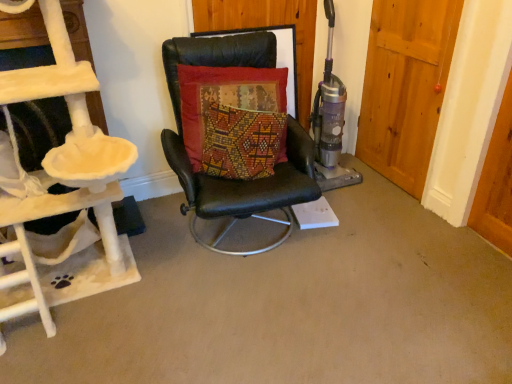
Question: Is black leather chair at center surrounded by velvet cushion at center?

Choices:
 (A) yes
 (B) no

Answer: (B)

Question: Can you confirm if velvet cushion at center is positioned to the right of black leather chair at center?

Choices:
 (A) yes
 (B) no

Answer: (B)

Question: Are velvet cushion at center and black leather chair at center beside each other?

Choices:
 (A) no
 (B) yes

Answer: (A)

Question: Is velvet cushion at center behind black leather chair at center?

Choices:
 (A) yes
 (B) no

Answer: (A)

Question: From the image's perspective, is velvet cushion at center located beneath black leather chair at center?

Choices:
 (A) yes
 (B) no

Answer: (B)

Question: Does point (247, 34) appear closer or farther from the camera than point (29, 71)?

Choices:
 (A) farther
 (B) closer

Answer: (A)

Question: Is black leather chair at center spatially inside beige plush cat tree at left, or outside of it?

Choices:
 (A) outside
 (B) inside

Answer: (A)

Question: In terms of size, does black leather chair at center appear bigger or smaller than beige plush cat tree at left?

Choices:
 (A) big
 (B) small

Answer: (B)

Question: From their relative heights in the image, would you say black leather chair at center is taller or shorter than beige plush cat tree at left?

Choices:
 (A) tall
 (B) short

Answer: (B)

Question: Considering the positions of black leather chair at center and wooden door at right in the image, is black leather chair at center bigger or smaller than wooden door at right?

Choices:
 (A) small
 (B) big

Answer: (B)

Question: Considering their positions, is black leather chair at center located in front of or behind wooden door at right?

Choices:
 (A) behind
 (B) front

Answer: (B)

Question: Is point (233, 200) closer or farther from the camera than point (376, 162)?

Choices:
 (A) farther
 (B) closer

Answer: (B)

Question: In terms of width, does black leather chair at center look wider or thinner when compared to wooden door at right?

Choices:
 (A) thin
 (B) wide

Answer: (B)

Question: Is point (93, 145) positioned closer to the camera than point (167, 153)?

Choices:
 (A) closer
 (B) farther

Answer: (A)

Question: Considering the positions of beige plush cat tree at left and black leather chair at center in the image, is beige plush cat tree at left taller or shorter than black leather chair at center?

Choices:
 (A) short
 (B) tall

Answer: (B)